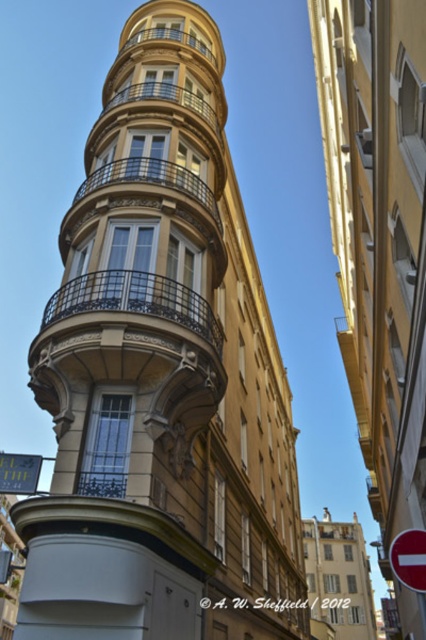
You are a pedestrian looking at the building with curved facade. You notice the red plastic traffic sign at upper right and the green reflective sign at center. Which sign is closer to you?

The red plastic traffic sign at upper right is in front of the green reflective sign at center, so it is closer to you.

You are an architect analyzing the building design. You need to compare the sizes of the golden stone tower at center and the red plastic traffic sign at upper right. Which one has a greater width?

The golden stone tower at center has a greater width than the red plastic traffic sign at upper right according to the description.